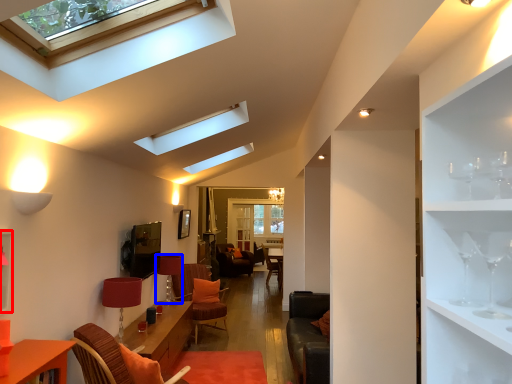
Question: Which object is closer to the camera taking this photo, shelf (highlighted by a red box) or lamp (highlighted by a blue box)?

Choices:
 (A) shelf
 (B) lamp

Answer: (A)